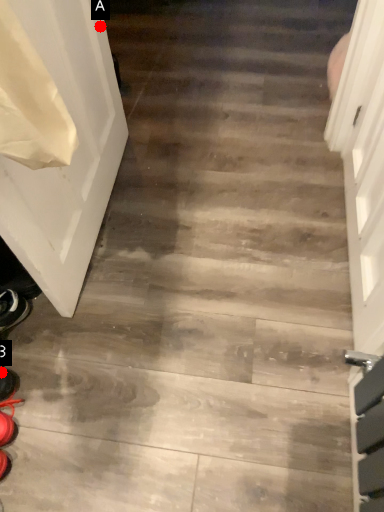
Question: Two points are circled on the image, labeled by A and B beside each circle. Among these points, which one is farthest from the camera?

Choices:
 (A) A is further
 (B) B is further

Answer: (A)